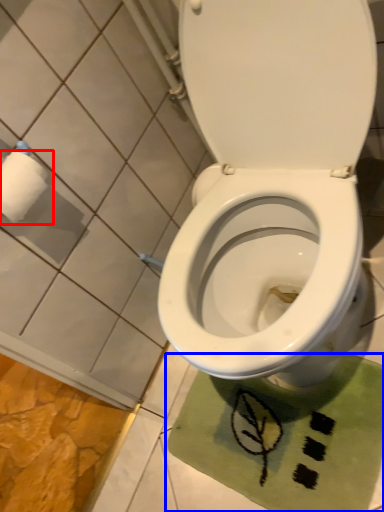
Question: Which of the following is the closest to the observer, toilet paper (highlighted by a red box) or bath mat (highlighted by a blue box)?

Choices:
 (A) toilet paper
 (B) bath mat

Answer: (A)